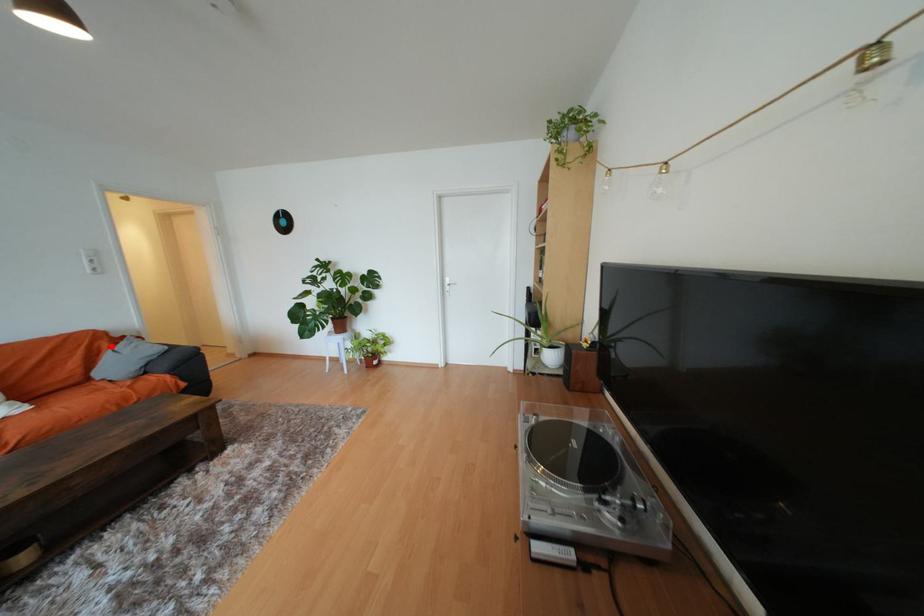
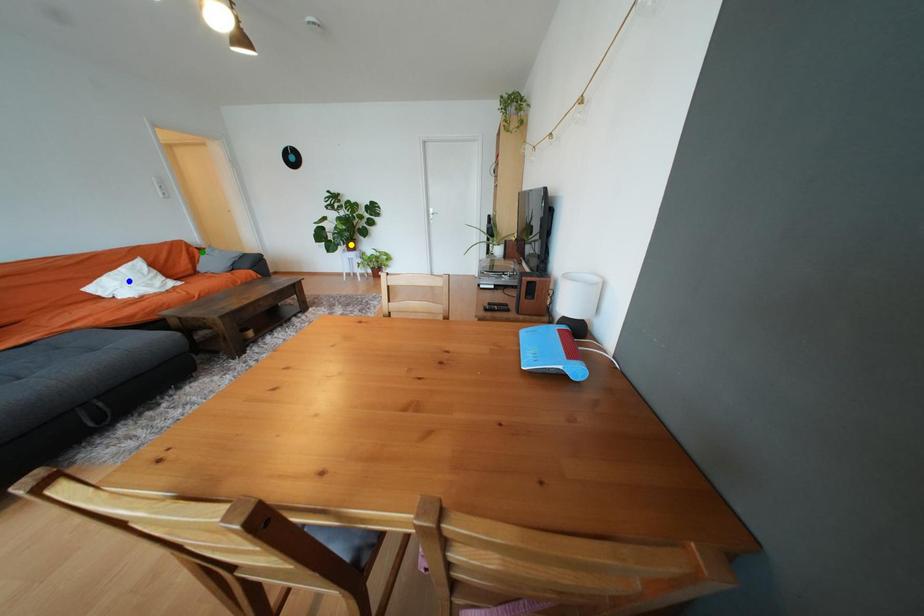
Question: I am providing you with two images of the same scene from different viewpoints. A red point is marked on the first image. You are given multiple points on the second image. Which mark in image 2 goes with the point in image 1?

Choices:
 (A) yellow point
 (B) green point
 (C) blue point

Answer: (B)